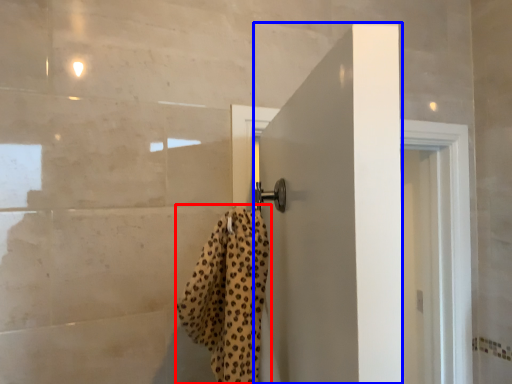
Question: Which of the following is the closest to the observer, bath towel (highlighted by a red box) or door (highlighted by a blue box)?

Choices:
 (A) bath towel
 (B) door

Answer: (A)